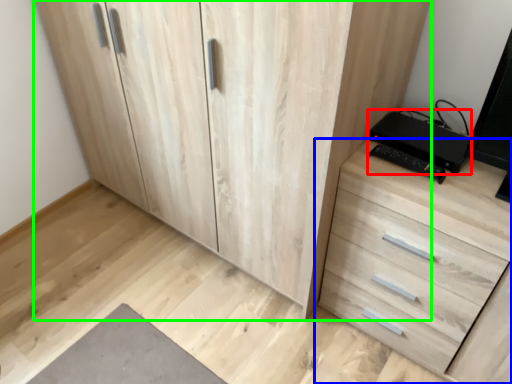
Question: Considering the real-world distances, which object is farthest from computer (highlighted by a red box)? chest of drawers (highlighted by a blue box) or cupboard (highlighted by a green box)?

Choices:
 (A) chest of drawers
 (B) cupboard

Answer: (B)